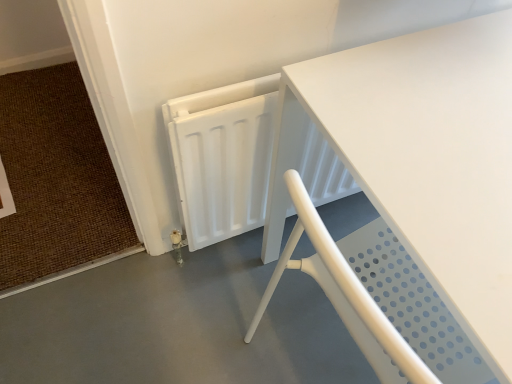
Question: Considering the relative positions of white perforated chair at lower right and brown woven mat at lower left in the image provided, is white perforated chair at lower right to the left or to the right of brown woven mat at lower left?

Choices:
 (A) left
 (B) right

Answer: (B)

Question: Looking at their shapes, would you say white perforated chair at lower right is wider or thinner than brown woven mat at lower left?

Choices:
 (A) thin
 (B) wide

Answer: (A)

Question: Estimate the real-world distances between objects in this image. Which object is closer to the white matte table at center?

Choices:
 (A) white perforated chair at lower right
 (B) brown woven mat at lower left

Answer: (A)

Question: Estimate the real-world distances between objects in this image. Which object is farther from the white perforated chair at lower right?

Choices:
 (A) brown woven mat at lower left
 (B) white matte table at center

Answer: (B)